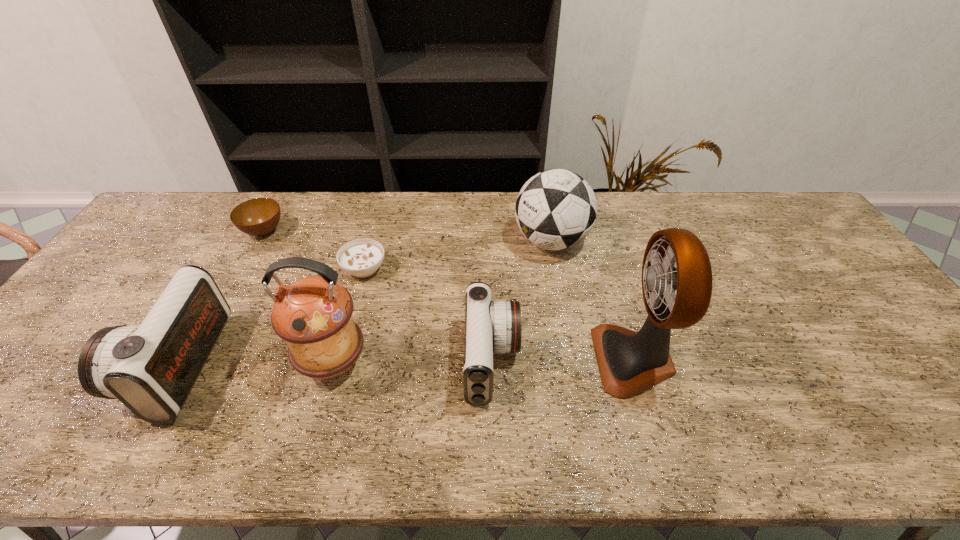
The width and height of the screenshot is (960, 540). I want to click on vacant space positioned 0.240m on the front of the shortest object, so tap(341, 356).

Locate an element on the screen. vacant area situated 0.070m on the left of the oil lamp is located at coordinates (270, 363).

This screenshot has height=540, width=960. Find the location of `soccer ball that is at the far edge`. soccer ball that is at the far edge is located at coordinates [556, 209].

Where is `bowl that is at the far edge`? The height and width of the screenshot is (540, 960). bowl that is at the far edge is located at coordinates (258, 217).

Identify the location of fan present at the near edge. (630, 363).

Locate an element on the screen. oil lamp that is at the near edge is located at coordinates (313, 314).

The width and height of the screenshot is (960, 540). Identify the location of vacant space at the far edge. (467, 205).

Identify the location of vacant region at the near edge of the desktop. The width and height of the screenshot is (960, 540). (712, 405).

In the image, there is a desktop. At what (x,y) coordinates should I click in order to perform the action: click on vacant space at the left edge. Please return your answer as a coordinate pair (x, y). The height and width of the screenshot is (540, 960). Looking at the image, I should click on (182, 242).

This screenshot has width=960, height=540. What are the coordinates of `vacant space at the far left corner` in the screenshot? It's located at (167, 221).